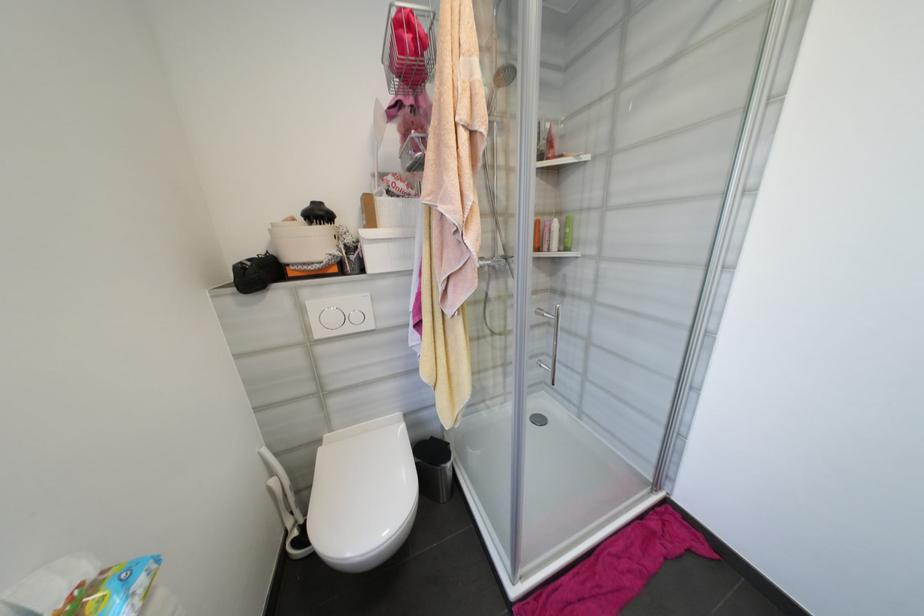
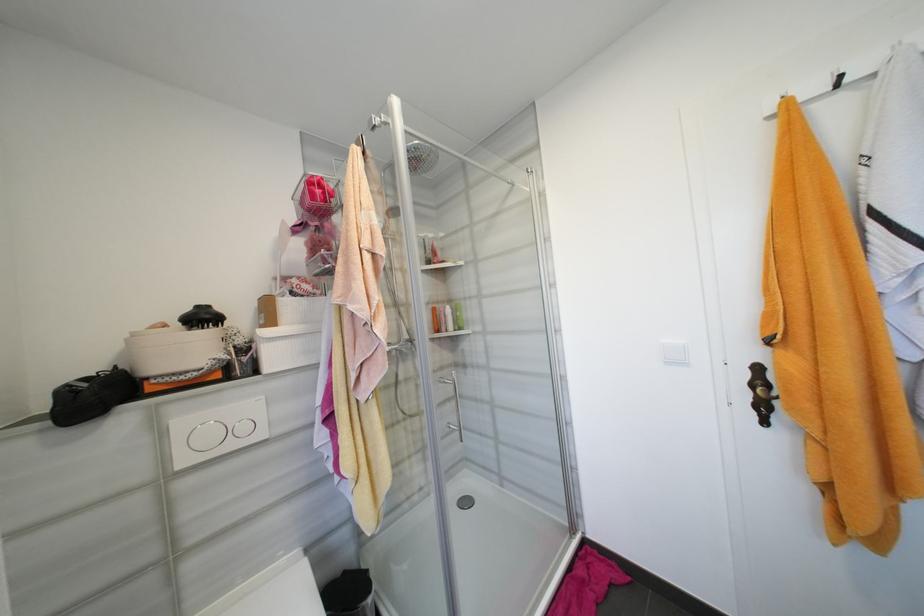
Find the pixel in the second image that matches (551,249) in the first image.

(450, 330)